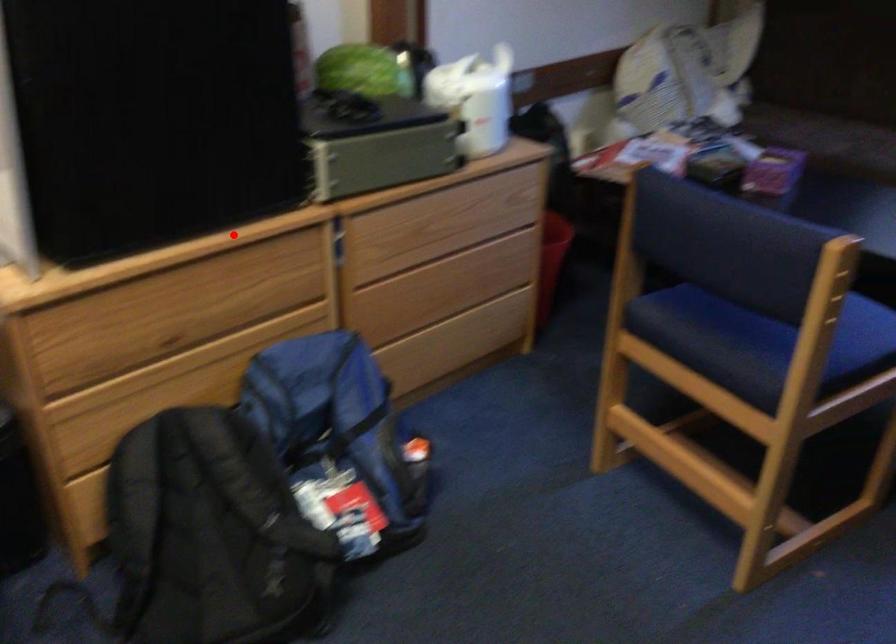
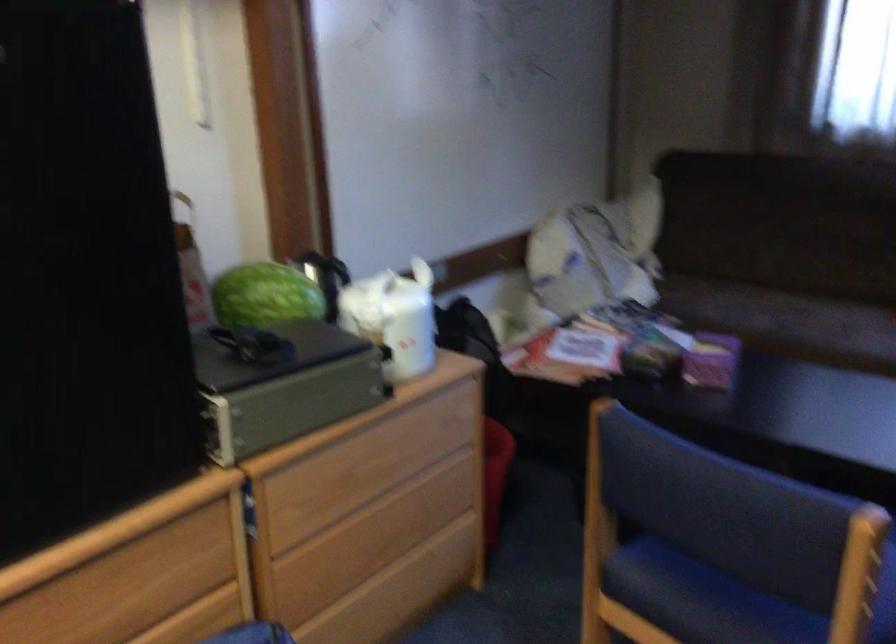
Question: I am providing you with two images of the same scene from different viewpoints. In image1, a red point is highlighted. Considering the same 3D point in image2, which of the following is correct?

Choices:
 (A) It is closer
 (B) It is farther

Answer: (A)